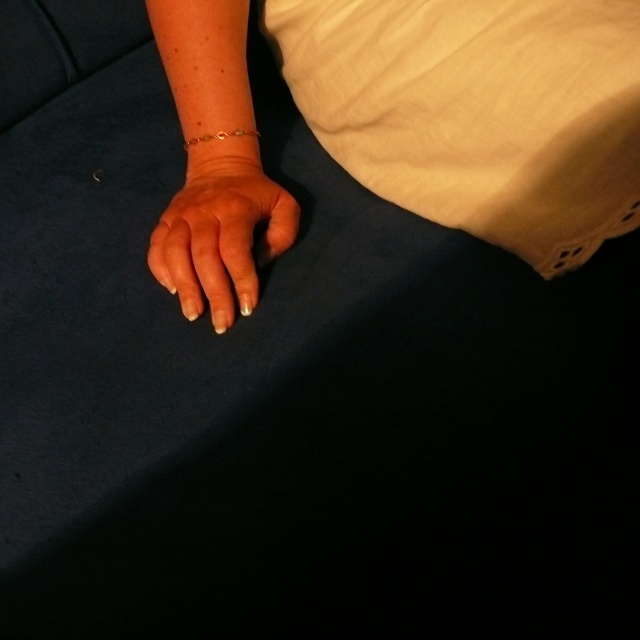
Does smooth skin hand at center come behind gold metallic bracelet at center?

No, it is in front of gold metallic bracelet at center.

Which is behind, point (244, 209) or point (259, 132)?

Positioned behind is point (259, 132).

Find the location of `smooth skin hand at center`. smooth skin hand at center is located at coordinates (220, 236).

Which of these two, white cotton pillow at upper right or gold metallic bracelet at center, stands taller?

With more height is white cotton pillow at upper right.

Locate an element on the screen. The image size is (640, 640). white cotton pillow at upper right is located at coordinates (477, 112).

Is white cotton pillow at upper right wider than smooth skin hand at center?

Yes, white cotton pillow at upper right is wider than smooth skin hand at center.

Can you confirm if white cotton pillow at upper right is shorter than smooth skin hand at center?

In fact, white cotton pillow at upper right may be taller than smooth skin hand at center.

Who is more forward, (384, 84) or (240, 236)?

Point (240, 236) is more forward.

This screenshot has height=640, width=640. I want to click on white cotton pillow at upper right, so click(x=477, y=112).